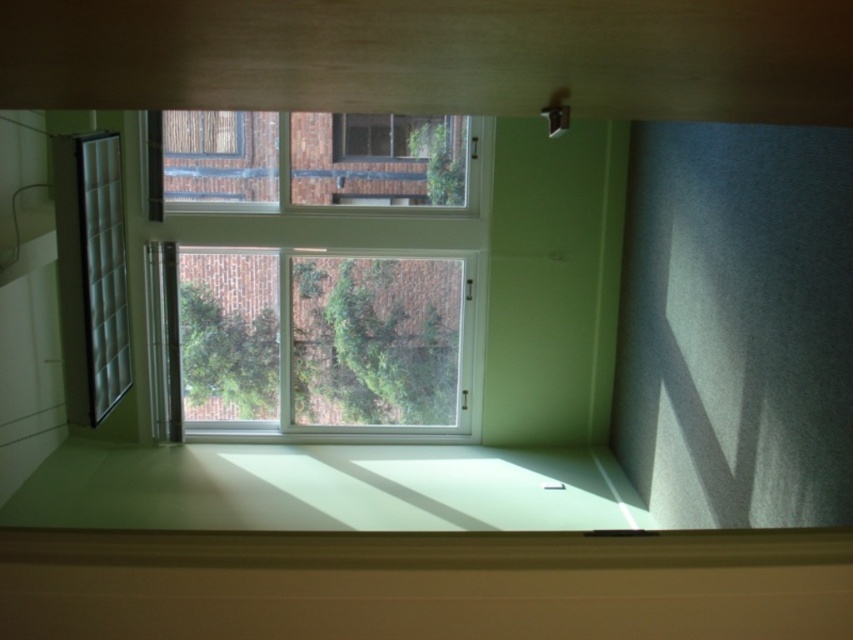
Between white matte curtain at right and white plastic window at center, which one has less height?

white plastic window at center is shorter.

The image size is (853, 640). What do you see at coordinates (735, 324) in the screenshot?
I see `white matte curtain at right` at bounding box center [735, 324].

Identify the location of white matte curtain at right. The image size is (853, 640). (735, 324).

Is white matte curtain at right in front of translucent fabric curtain at left?

Yes, white matte curtain at right is in front of translucent fabric curtain at left.

Which is behind, point (772, 428) or point (120, 321)?

The point (120, 321) is more distant.

Which is in front, point (781, 358) or point (94, 234)?

Point (781, 358) is in front.

You are a GUI agent. You are given a task and a screenshot of the screen. Output one action in this format:
    pyautogui.click(x=<x>, y=<y>)
    Task: Click on the white matte curtain at right
    The height and width of the screenshot is (640, 853).
    Given the screenshot: What is the action you would take?
    pyautogui.click(x=735, y=324)

This screenshot has width=853, height=640. I want to click on white matte curtain at right, so click(735, 324).

Which is behind, point (749, 468) or point (260, 188)?

The point (260, 188) is behind.

Locate an element on the screen. white matte curtain at right is located at coordinates (735, 324).